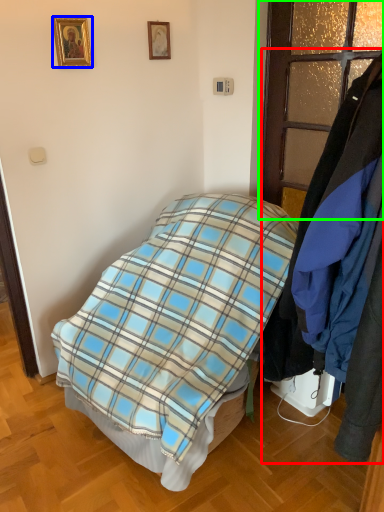
Question: Which object is positioned farthest from closet (highlighted by a red box)? Select from picture frame (highlighted by a blue box) and glass door (highlighted by a green box).

Choices:
 (A) picture frame
 (B) glass door

Answer: (A)